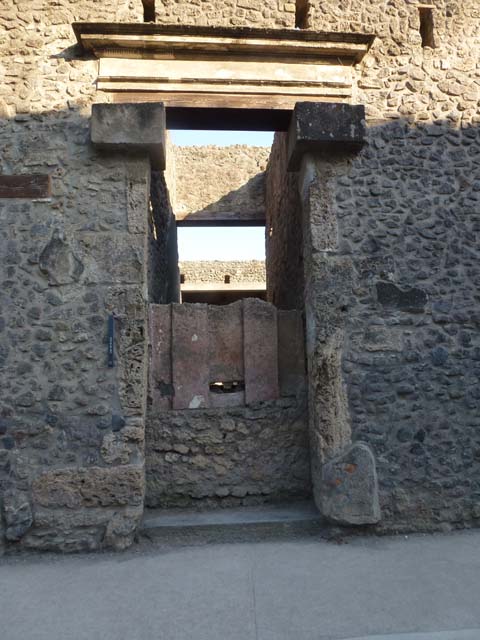
Where is `right wall of opening`? right wall of opening is located at coordinates (279, 226).